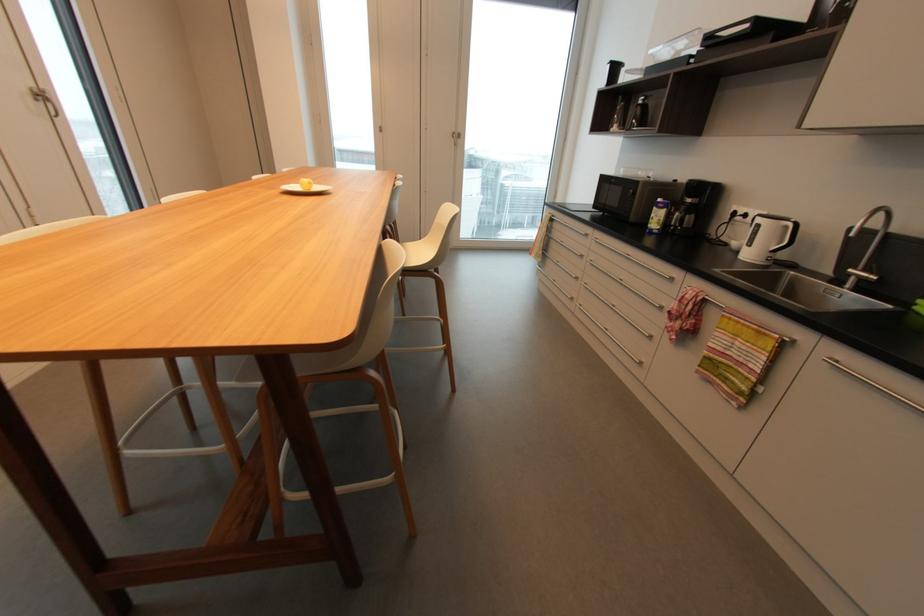
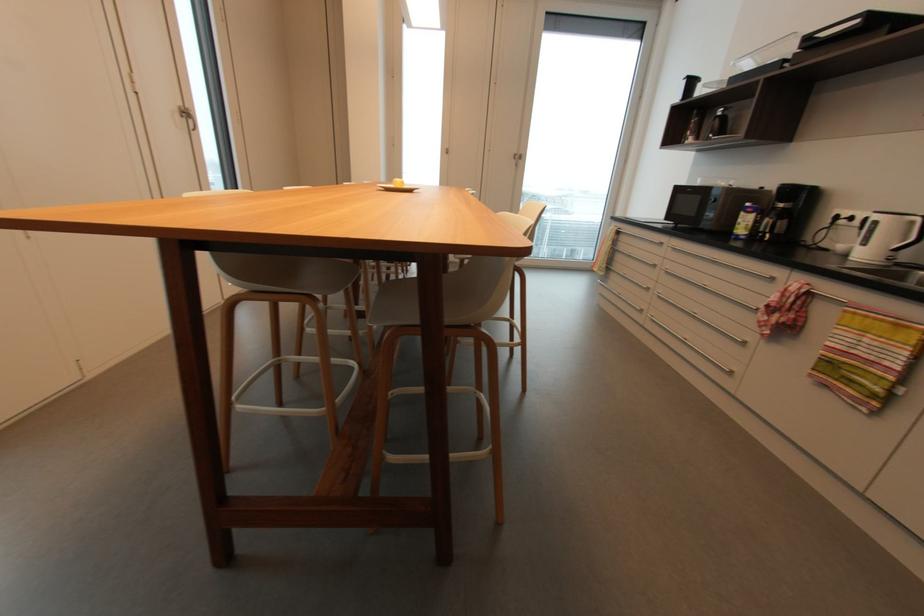
Where in the second image is the point corresponding to pixel 675 280 from the first image?

(775, 280)